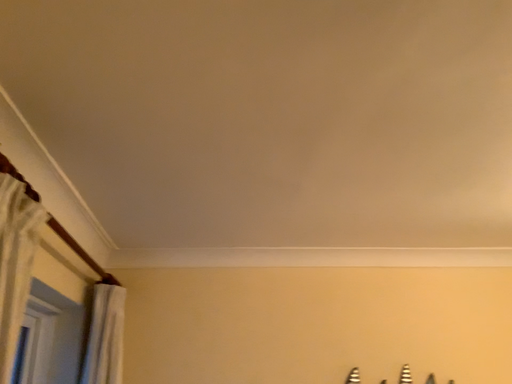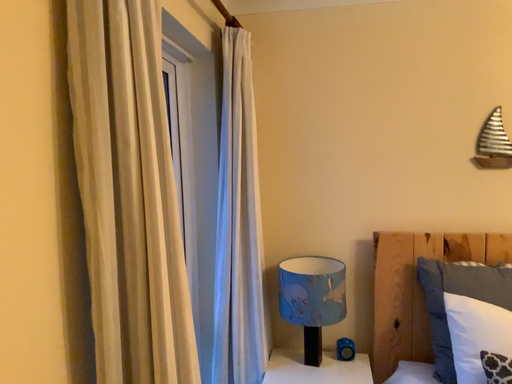
Question: Which way did the camera rotate in the video?

Choices:
 (A) rotated right
 (B) rotated left

Answer: (B)